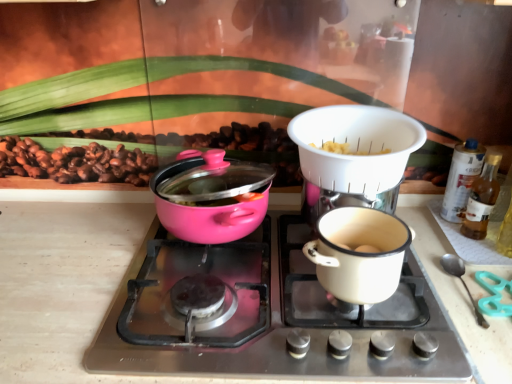
Where is `silver spoon at right`? silver spoon at right is located at coordinates (461, 281).

What do you see at coordinates (234, 348) in the screenshot? The width and height of the screenshot is (512, 384). I see `pink glossy pot at center left` at bounding box center [234, 348].

The width and height of the screenshot is (512, 384). Find the location of `silver spoon at right`. silver spoon at right is located at coordinates (461, 281).

Are translucent plastic spray can at right, the 2th bottle when ordered from front to back, and white plastic colander at upper center making contact?

No, translucent plastic spray can at right, the 2th bottle when ordered from front to back, is not making contact with white plastic colander at upper center.

Starting from the white plastic colander at upper center, which bottle is the 2nd one behind? Please provide its 2D coordinates.

[(461, 179)]

Can you confirm if translucent plastic spray can at right, the 2th bottle when ordered from front to back, is bigger than white plastic colander at upper center?

No, translucent plastic spray can at right, the 2th bottle when ordered from front to back, is not bigger than white plastic colander at upper center.

Considering the sizes of objects silver spoon at right and pink glossy pot at left in the image provided, who is taller, silver spoon at right or pink glossy pot at left?

Standing taller between the two is pink glossy pot at left.

Is silver spoon at right positioned beyond the bounds of pink glossy pot at left?

silver spoon at right lies outside pink glossy pot at left's area.

Is silver spoon at right positioned far away from pink glossy pot at left?

That's not correct — silver spoon at right is a little close to pink glossy pot at left.

Looking at their sizes, would you say silver spoon at right is wider or thinner than pink glossy pot at left?

Clearly, silver spoon at right has less width compared to pink glossy pot at left.

Looking at this image, how much distance is there between white plastic colander at upper center and translucent plastic spray can at right, the 2th bottle when ordered from front to back?

10.95 inches.

Considering the sizes of white plastic colander at upper center and translucent plastic spray can at right, the 2th bottle when ordered from front to back, in the image, is white plastic colander at upper center wider or thinner than translucent plastic spray can at right, the 2th bottle when ordered from front to back,?

Clearly, white plastic colander at upper center has more width compared to translucent plastic spray can at right, the 2th bottle when ordered from front to back.

From the image's perspective, is white plastic colander at upper center located beneath translucent plastic spray can at right, the 2th bottle when ordered from front to back?

No, from the image's perspective, white plastic colander at upper center is not below translucent plastic spray can at right, the 2th bottle when ordered from front to back.

Can you tell me how much white plastic colander at upper center and translucent plastic spray can at right, the 2th bottle when ordered from front to back, differ in facing direction?

0.00394 degrees.

Is white plastic colander at upper center inside or outside of white enamel pot at center right?

white plastic colander at upper center is not enclosed by white enamel pot at center right.

From a real-world perspective, is white plastic colander at upper center above or below white enamel pot at center right?

white plastic colander at upper center is situated higher than white enamel pot at center right in the real world.

Could you tell me if white plastic colander at upper center is turned towards white enamel pot at center right?

No, white plastic colander at upper center is not turned towards white enamel pot at center right.

Can you confirm if silver spoon at right is taller than pink glossy pot at center left?

No.

From the image's perspective, would you say silver spoon at right is positioned over pink glossy pot at center left?

No, from the image's perspective, silver spoon at right is not over pink glossy pot at center left.

In terms of width, does silver spoon at right look wider or thinner when compared to pink glossy pot at center left?

Clearly, silver spoon at right has less width compared to pink glossy pot at center left.

Can you tell me how much silver spoon at right and pink glossy pot at center left differ in facing direction?

0.000556 degrees separate the facing orientations of silver spoon at right and pink glossy pot at center left.

Measure the distance from white enamel pot at center right to pink glossy pot at center left.

white enamel pot at center right is 6.03 inches from pink glossy pot at center left.

Is point (332, 224) positioned before point (356, 339)?

That is False.

Is white enamel pot at center right positioned with its back to pink glossy pot at center left?

No, white enamel pot at center right is not facing the opposite direction of pink glossy pot at center left.

From the picture: What's the angular difference between white enamel pot at center right and pink glossy pot at center left's facing directions?

The angle between the facing direction of white enamel pot at center right and the facing direction of pink glossy pot at center left is 0.00247 degrees.

Between translucent glass bottle at right, which appears as the second bottle when viewed from the back, and white plastic colander at upper center, which one appears on the right side from the viewer's perspective?

From the viewer's perspective, translucent glass bottle at right, which appears as the second bottle when viewed from the back, appears more on the right side.

At what (x,y) coordinates should I click in order to perform the action: click on the 2nd bottle positioned below the white plastic colander at upper center (from a real-world perspective). Please return your answer as a coordinate pair (x, y). The image size is (512, 384). Looking at the image, I should click on (x=482, y=199).

Which of these two, translucent glass bottle at right, which ranks as the 1th bottle in front-to-back order, or white plastic colander at upper center, stands shorter?

white plastic colander at upper center.

You are a GUI agent. You are given a task and a screenshot of the screen. Output one action in this format:
    pyautogui.click(x=<x>, y=<y>)
    Task: Click on the 1st bottle to the right when counting from the white plastic colander at upper center
    The width and height of the screenshot is (512, 384).
    Given the screenshot: What is the action you would take?
    pyautogui.click(x=461, y=179)

This screenshot has height=384, width=512. Find the location of `silverware behind the pink glossy pot at left`. silverware behind the pink glossy pot at left is located at coordinates (461, 281).

Which object lies further to the anchor point pink glossy pot at left, white plastic colander at upper center or silver spoon at right?

silver spoon at right is further to pink glossy pot at left.

Considering their positions, is white enamel pot at center right positioned further to silver spoon at right than white plastic colander at upper center?

white plastic colander at upper center.

When comparing their distances from white enamel pot at center right, does white plastic colander at upper center or pink glossy pot at left seem further?

Among the two, pink glossy pot at left is located further to white enamel pot at center right.

Which object lies further to the anchor point pink glossy pot at left, translucent plastic spray can at right, placed as the first bottle when sorted from back to front, or silver spoon at right?

translucent plastic spray can at right, placed as the first bottle when sorted from back to front.

Estimate the real-world distances between objects in this image. Which object is closer to translucent plastic spray can at right, the 2th bottle when ordered from front to back, pink glossy pot at center left or white enamel pot at center right?

Based on the image, white enamel pot at center right appears to be nearer to translucent plastic spray can at right, the 2th bottle when ordered from front to back.

Based on their spatial positions, is translucent glass bottle at right, which appears as the second bottle when viewed from the back, or silver spoon at right closer to pink glossy pot at left?

silver spoon at right.

Based on their spatial positions, is pink glossy pot at center left or translucent glass bottle at right, which appears as the second bottle when viewed from the back, closer to white plastic colander at upper center?

pink glossy pot at center left.

Estimate the real-world distances between objects in this image. Which object is closer to translucent glass bottle at right, which appears as the second bottle when viewed from the back, white plastic colander at upper center or pink glossy pot at left?

Among the two, white plastic colander at upper center is located nearer to translucent glass bottle at right, which appears as the second bottle when viewed from the back.

At what (x,y) coordinates should I click in order to perform the action: click on bottle between white plastic colander at upper center and translucent glass bottle at right, which ranks as the 1th bottle in front-to-back order, in the horizontal direction. Please return your answer as a coordinate pair (x, y). This screenshot has height=384, width=512. Looking at the image, I should click on (461, 179).

Find the location of a particular element. coffee cup between pink glossy pot at center left and silver spoon at right from left to right is located at coordinates (359, 253).

You are a GUI agent. You are given a task and a screenshot of the screen. Output one action in this format:
    pyautogui.click(x=<x>, y=<y>)
    Task: Click on the bottle between pink glossy pot at left and translucent glass bottle at right, which ranks as the 1th bottle in front-to-back order
    The height and width of the screenshot is (384, 512).
    Given the screenshot: What is the action you would take?
    pyautogui.click(x=461, y=179)

Where is `silverware located between pink glossy pot at center left and translucent plastic spray can at right, the 2th bottle when ordered from front to back, in the left-right direction`? This screenshot has width=512, height=384. silverware located between pink glossy pot at center left and translucent plastic spray can at right, the 2th bottle when ordered from front to back, in the left-right direction is located at coordinates (461, 281).